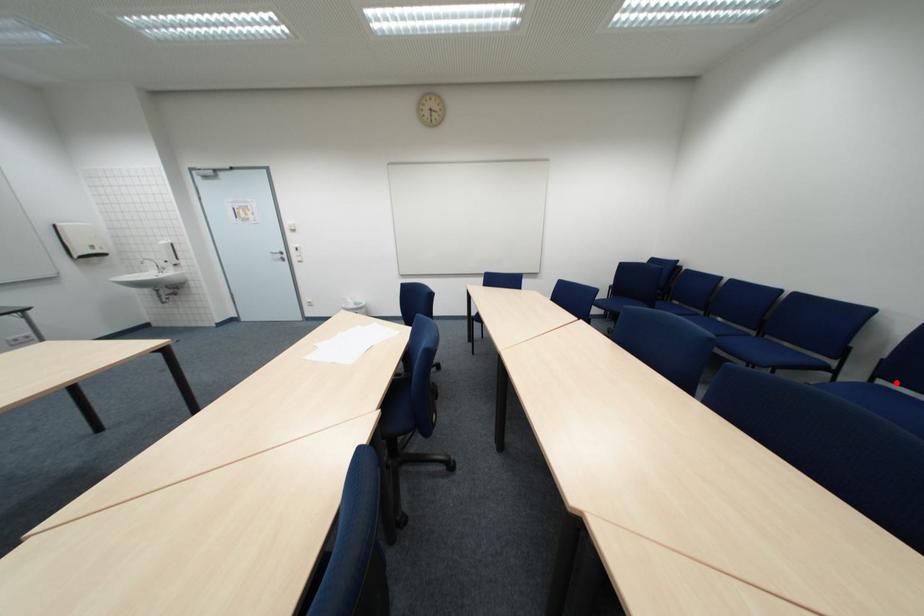
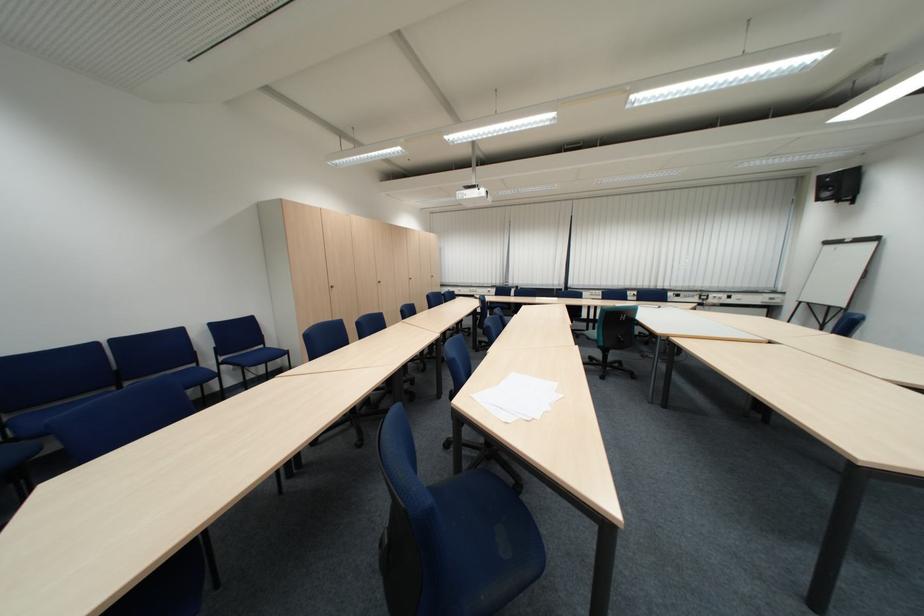
Question: I am providing you with two images of the same scene from different viewpoints. Image1 has a red point marked. In image2, the corresponding 3D location appears at what relative position? Reply with the corresponding letter.

Choices:
 (A) Closer
 (B) Farther

Answer: (A)